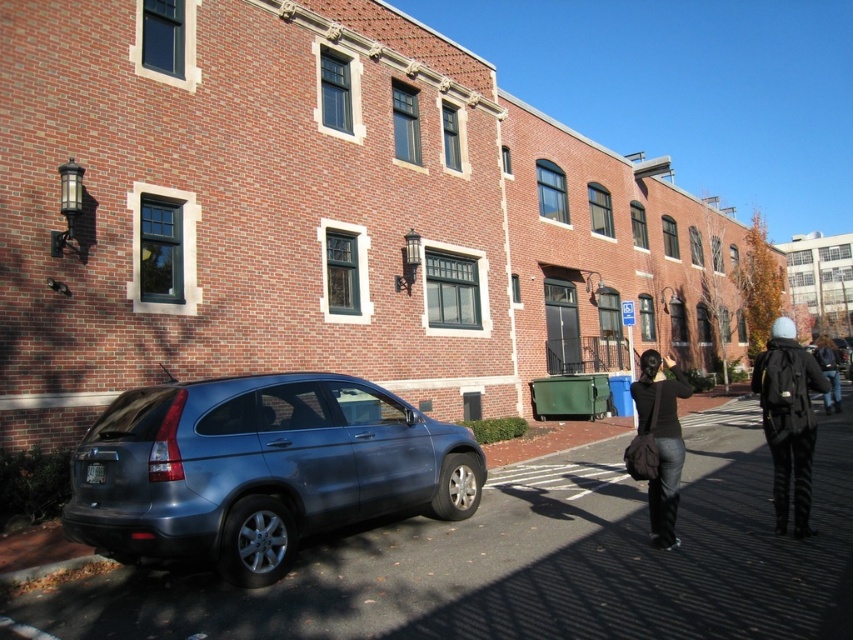
Is dark brown leather bag at lower right wider than dark blue jeans at lower right?

Incorrect, dark brown leather bag at lower right's width does not surpass dark blue jeans at lower right's.

Between dark brown leather bag at lower right and dark blue jeans at lower right, which one appears on the right side from the viewer's perspective?

dark blue jeans at lower right is more to the right.

Who is more distant from viewer, [680,461] or [813,348]?

Point [813,348]

The height and width of the screenshot is (640, 853). I want to click on dark brown leather bag at lower right, so click(660, 438).

In the scene shown: How much distance is there between metallic gray car at lower left and white woolen hat at right?

A distance of 2.45 meters exists between metallic gray car at lower left and white woolen hat at right.

From the picture: Which is below, metallic gray car at lower left or white woolen hat at right?

metallic gray car at lower left is below.

Who is more distant from viewer, (759,604) or (813,381)?

Positioned behind is point (813,381).

Where is `metallic gray car at lower left`? The height and width of the screenshot is (640, 853). metallic gray car at lower left is located at coordinates (527, 563).

Is satin blue minivan at lower left wider than dark brown leather bag at lower right?

No.

Which of these two, satin blue minivan at lower left or dark brown leather bag at lower right, stands taller?

dark brown leather bag at lower right

Where is `satin blue minivan at lower left`? The height and width of the screenshot is (640, 853). satin blue minivan at lower left is located at coordinates (259, 468).

At what (x,y) coordinates should I click in order to perform the action: click on satin blue minivan at lower left. Please return your answer as a coordinate pair (x, y). The width and height of the screenshot is (853, 640). Looking at the image, I should click on (259, 468).